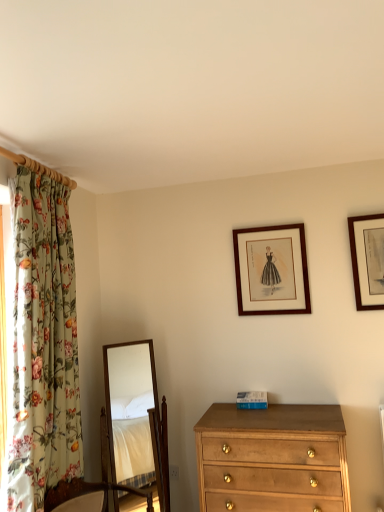
Question: Considering their positions, is wooden mirror at center located in front of or behind wooden framed print at upper center, the 1th picture frame viewed from the left?

Choices:
 (A) behind
 (B) front

Answer: (B)

Question: In terms of size, does wooden mirror at center appear bigger or smaller than wooden framed print at upper center, the 1th picture frame viewed from the left?

Choices:
 (A) big
 (B) small

Answer: (A)

Question: Considering the real-world distances, which object is closest to the wooden picture frame at upper right, which ranks as the 1th picture frame in front-to-back order?

Choices:
 (A) wooden framed print at upper center, the first picture frame positioned from the back
 (B) light brown wood chest of drawers at lower right
 (C) floral fabric curtain at left
 (D) wooden mirror at center

Answer: (A)

Question: Which object is positioned closest to the floral fabric curtain at left?

Choices:
 (A) light brown wood chest of drawers at lower right
 (B) wooden mirror at center
 (C) wooden picture frame at upper right, marked as the first picture frame in a right-to-left arrangement
 (D) wooden framed print at upper center, the first picture frame positioned from the back

Answer: (A)